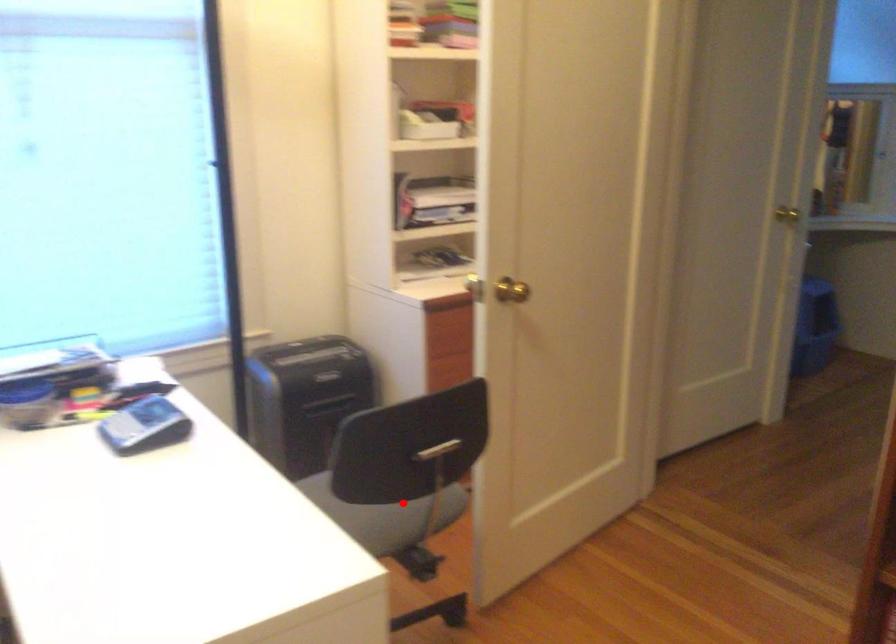
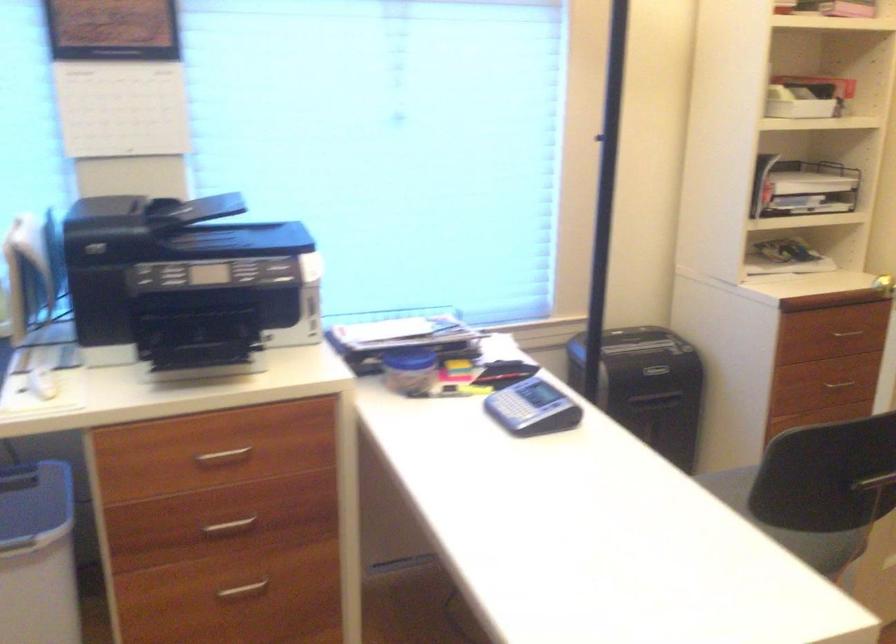
Locate, in the second image, the point that corresponds to the highlighted location in the first image.

(788, 525)